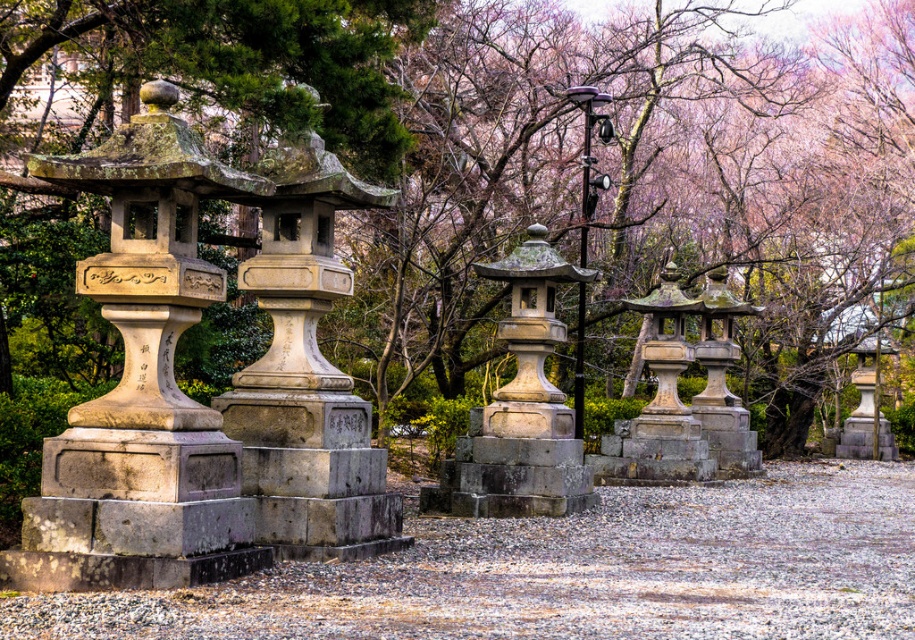
Does gray gravel at center have a greater width compared to polished metal lamp post at center?

Yes, gray gravel at center is wider than polished metal lamp post at center.

Where is `gray gravel at center`? gray gravel at center is located at coordinates (572, 572).

What do you see at coordinates (561, 163) in the screenshot?
I see `green textured stone lantern at center` at bounding box center [561, 163].

In the scene shown: Who is positioned more to the right, green textured stone lantern at center or gray gravel at center?

Positioned to the right is gray gravel at center.

Who is more forward, (362, 368) or (437, 529)?

Point (437, 529)

In order to click on green textured stone lantern at center in this screenshot , I will do `click(561, 163)`.

Can you confirm if green textured stone lantern at center is thinner than polished metal lamp post at center?

In fact, green textured stone lantern at center might be wider than polished metal lamp post at center.

Can you confirm if green textured stone lantern at center is smaller than polished metal lamp post at center?

No.

This screenshot has height=640, width=915. Identify the location of green textured stone lantern at center. (561, 163).

Where is `green textured stone lantern at center`? The width and height of the screenshot is (915, 640). green textured stone lantern at center is located at coordinates point(561,163).